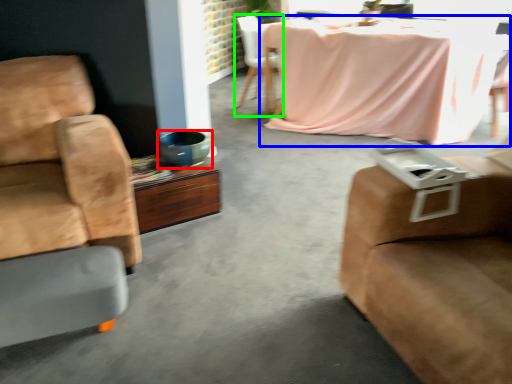
Question: Estimate the real-world distances between objects in this image. Which object is farther from vase (highlighted by a red box), kitchen & dining room table (highlighted by a blue box) or chair (highlighted by a green box)?

Choices:
 (A) kitchen & dining room table
 (B) chair

Answer: (B)